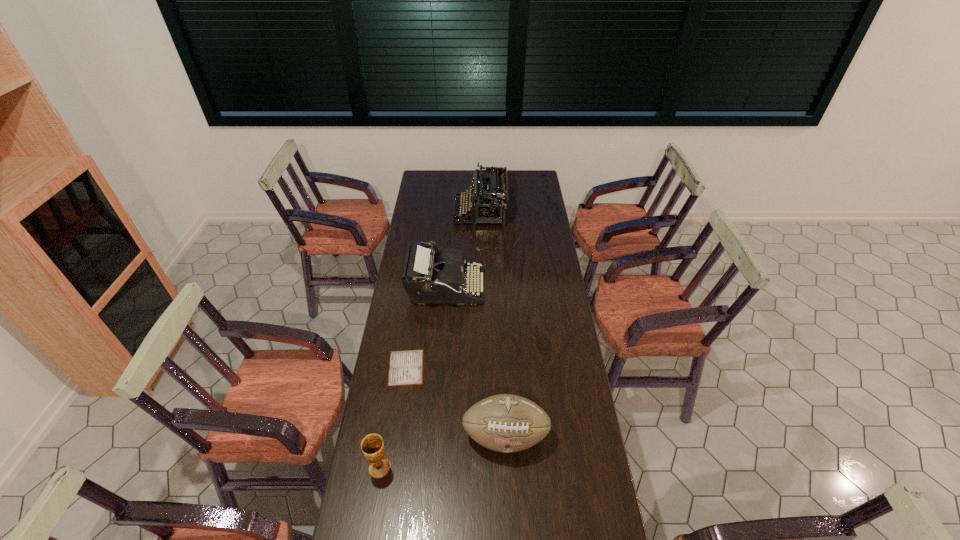
Find the location of a particular element. The width and height of the screenshot is (960, 540). blank space located 0.150m on the typing side of the farthest object is located at coordinates (427, 212).

At what (x,y) coordinates should I click in order to perform the action: click on blank space located 0.240m on the front-facing side of the fourth nearest object. Please return your answer as a coordinate pair (x, y). This screenshot has width=960, height=540. Looking at the image, I should click on (536, 289).

At what (x,y) coordinates should I click in order to perform the action: click on vacant space located on the laces of the football (American). Please return your answer as a coordinate pair (x, y). This screenshot has height=540, width=960. Looking at the image, I should click on (508, 484).

Where is `vacant position located 0.310m on the right of the chalice`? Image resolution: width=960 pixels, height=540 pixels. vacant position located 0.310m on the right of the chalice is located at coordinates point(487,468).

You are a GUI agent. You are given a task and a screenshot of the screen. Output one action in this format:
    pyautogui.click(x=<x>, y=<y>)
    Task: Click on the vacant space located 0.050m on the right of the diary
    
    Given the screenshot: What is the action you would take?
    pyautogui.click(x=438, y=368)

Locate an element on the screen. typewriter that is at the left edge is located at coordinates (429, 277).

Find the location of `chalice located in the left edge section of the desktop`. chalice located in the left edge section of the desktop is located at coordinates (372, 445).

I want to click on diary located at the left edge, so click(406, 367).

This screenshot has width=960, height=540. Find the location of `object at the right edge`. object at the right edge is located at coordinates (506, 423).

Image resolution: width=960 pixels, height=540 pixels. In order to click on free region at the far edge of the desktop in this screenshot , I will do `click(446, 184)`.